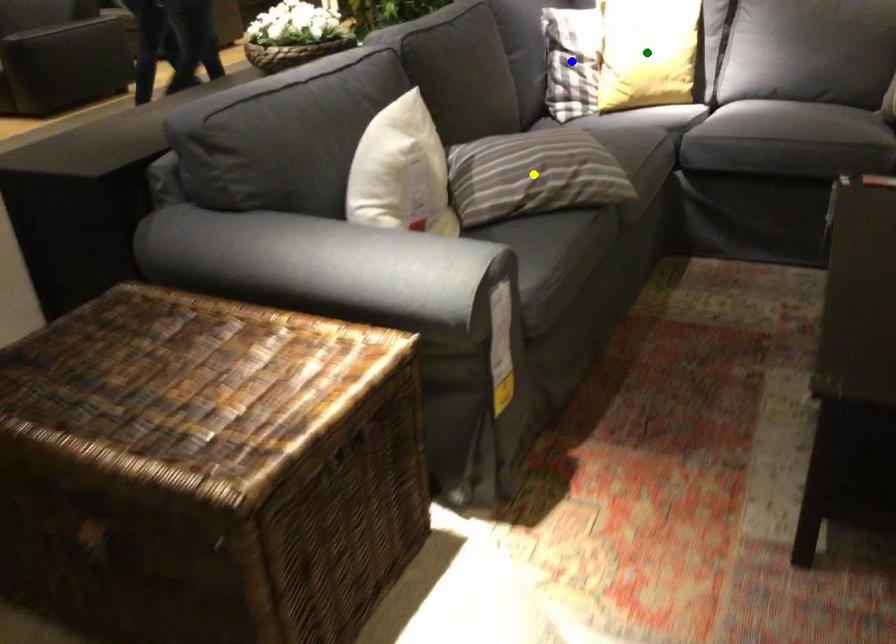
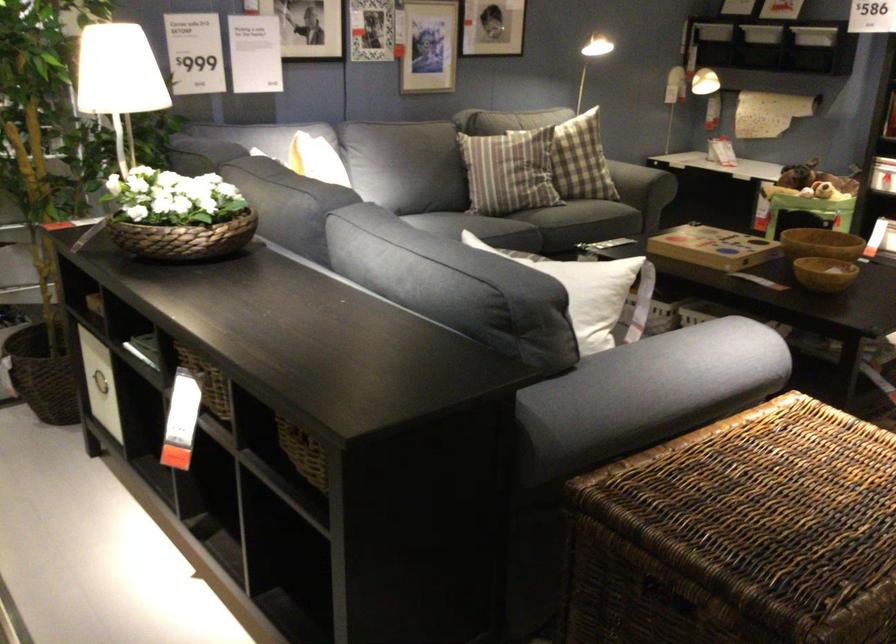
I am providing you with two images of the same scene from different viewpoints. Three points are marked in image1. Which point corresponds to a part or object that is occluded in image2?In image1, three points are marked. Which of them correspond to a part or object that is occluded in image2?Among the three points shown in image1, which one corresponds to a part or object that is no longer visible due to occlusion in image2?

blue point, green point, yellow point cannot be seen in image2.